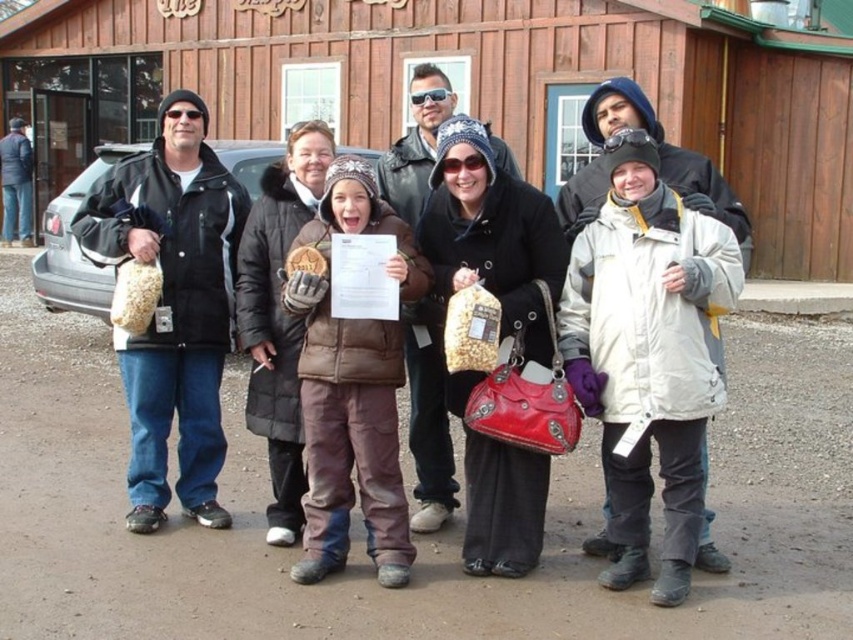
You are standing at the origin point of the coordinate system where the bottom left corner of the image is the origin. The image has a width of 1 unit and a height of 1 unit. Where is the matte black jacket at left located in terms of coordinates?

The matte black jacket at left is located at coordinates point (172, 305).

You are standing in front of the wooden hut at center and want to hand a document to the person wearing the matte black jacket at left. How should you move to reach them?

The wooden hut at center is closer to you than the matte black jacket at left, so you should move forward away from the wooden hut at center to reach the matte black jacket at left.

Consider the image. You are standing at the origin point in the image. Which direction should you move to reach the wooden hut at center?

The wooden hut at center is located at point (491,83), so you should move towards the lower left direction from the origin point to reach it.